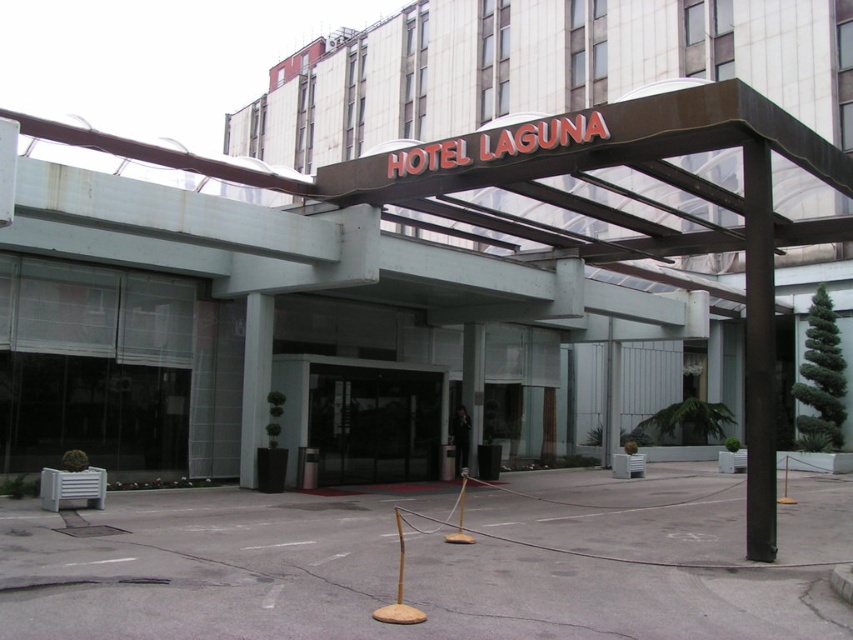
Question: Which object appears farthest from the camera in this image?

Choices:
 (A) black polished pole at center
 (B) white glossy pillar at center
 (C) transparent glass door at center

Answer: (C)

Question: Considering the relative positions of metallic signboard at center and black polished pole at center in the image provided, where is metallic signboard at center located with respect to black polished pole at center?

Choices:
 (A) above
 (B) below

Answer: (A)

Question: Among these objects, which one is farthest from the camera?

Choices:
 (A) black polished pole at center
 (B) transparent glass door at center

Answer: (B)

Question: Which object is the closest to the black polished pole at center?

Choices:
 (A) white glossy pillar at center
 (B) transparent glass door at center

Answer: (B)

Question: Does transparent glass door at center appear under black polished pole at center?

Choices:
 (A) no
 (B) yes

Answer: (B)

Question: Does transparent glass door at center have a larger size compared to black polished pole at center?

Choices:
 (A) no
 (B) yes

Answer: (A)